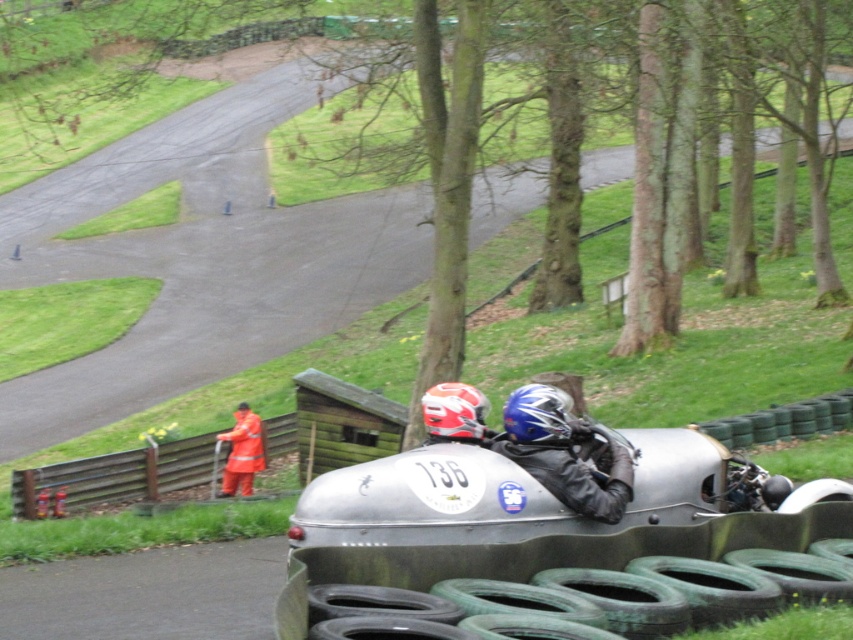
In the scene shown: Between red matte helmet at center and orange reflective jacket at center, which one has more height?

Standing taller between the two is orange reflective jacket at center.

Between red matte helmet at center and orange reflective jacket at center, which one has less height?

red matte helmet at center

What do you see at coordinates (456, 412) in the screenshot? The width and height of the screenshot is (853, 640). I see `red matte helmet at center` at bounding box center [456, 412].

The height and width of the screenshot is (640, 853). I want to click on red matte helmet at center, so click(x=456, y=412).

Who is more forward, (737,589) or (577,467)?

Point (737,589) is in front.

Is green rubber tires at lower center taller than shiny blue helmet at center?

No.

Does point (625, 595) come in front of point (564, 502)?

Yes, it is in front of point (564, 502).

This screenshot has height=640, width=853. Identify the location of green rubber tires at lower center. (592, 595).

Does shiny blue helmet at center have a lesser height compared to orange reflective jacket at center?

Indeed, shiny blue helmet at center has a lesser height compared to orange reflective jacket at center.

Is point (570, 449) less distant than point (227, 467)?

Yes, it is.

This screenshot has height=640, width=853. Find the location of `shiny blue helmet at center`. shiny blue helmet at center is located at coordinates (564, 452).